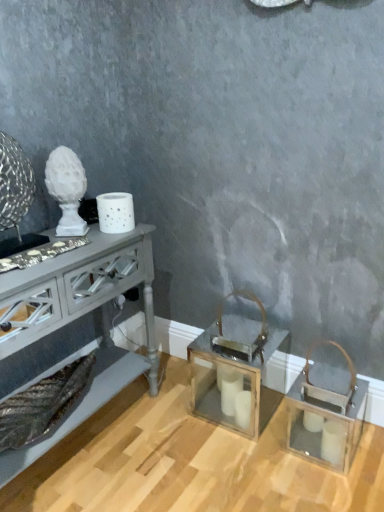
Question: Would you say clear glass lantern at center, the 1th table positioned from the right, is outside matte gray console table at left, acting as the second table starting from the right?

Choices:
 (A) yes
 (B) no

Answer: (A)

Question: Can matte gray console table at left, acting as the second table starting from the right, be found inside clear glass lantern at center, the 2th table in the left-to-right sequence?

Choices:
 (A) no
 (B) yes

Answer: (A)

Question: Is clear glass lantern at center, the 1th table positioned from the right, looking in the opposite direction of matte gray console table at left, acting as the second table starting from the right?

Choices:
 (A) yes
 (B) no

Answer: (B)

Question: Is clear glass lantern at center, the 2th table in the left-to-right sequence, wider than matte gray console table at left, which is the first table in left-to-right order?

Choices:
 (A) no
 (B) yes

Answer: (A)

Question: Is clear glass lantern at center, the 2th table in the left-to-right sequence, aimed at matte gray console table at left, which is the first table in left-to-right order?

Choices:
 (A) yes
 (B) no

Answer: (B)

Question: Is clear glass lantern at center, the 2th table in the left-to-right sequence, behind matte gray console table at left, acting as the second table starting from the right?

Choices:
 (A) no
 (B) yes

Answer: (B)

Question: Would you say matte gray console table at left, which is the first table in left-to-right order, contains clear glass lantern at center, the 2th table in the left-to-right sequence?

Choices:
 (A) yes
 (B) no

Answer: (B)

Question: Can you confirm if matte gray console table at left, acting as the second table starting from the right, is bigger than clear glass lantern at center, the 1th table positioned from the right?

Choices:
 (A) yes
 (B) no

Answer: (A)

Question: Does matte gray console table at left, acting as the second table starting from the right, appear on the right side of clear glass lantern at center, the 1th table positioned from the right?

Choices:
 (A) yes
 (B) no

Answer: (B)

Question: Is matte gray console table at left, which is the first table in left-to-right order, at the left side of clear glass lantern at center, the 1th table positioned from the right?

Choices:
 (A) no
 (B) yes

Answer: (B)

Question: Considering the relative sizes of matte gray console table at left, which is the first table in left-to-right order, and clear glass lantern at center, the 2th table in the left-to-right sequence, in the image provided, is matte gray console table at left, which is the first table in left-to-right order, thinner than clear glass lantern at center, the 2th table in the left-to-right sequence,?

Choices:
 (A) no
 (B) yes

Answer: (A)

Question: Is matte gray console table at left, which is the first table in left-to-right order, not inside clear glass lantern at center, the 1th table positioned from the right?

Choices:
 (A) no
 (B) yes

Answer: (B)

Question: Considering their positions, is clear glass lantern at center, the 2th table in the left-to-right sequence, located in front of or behind matte gray console table at left, which is the first table in left-to-right order?

Choices:
 (A) front
 (B) behind

Answer: (B)